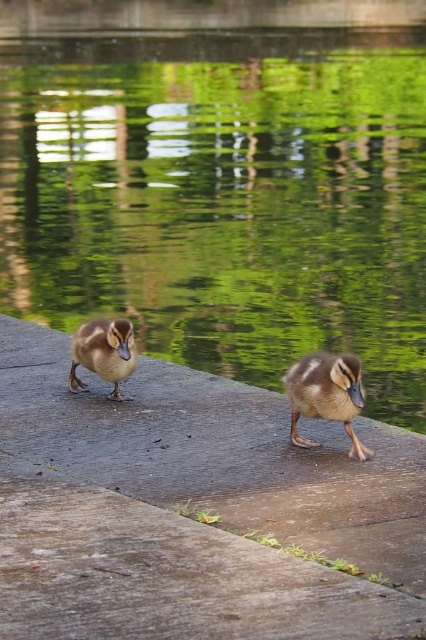
Is brown concrete ledge at center shorter than brown matte duckling at center?

No.

Describe the element at coordinates (192, 509) in the screenshot. I see `brown concrete ledge at center` at that location.

Locate an element on the screen. The image size is (426, 640). brown concrete ledge at center is located at coordinates (192, 509).

Where is `brown concrete ledge at center`? This screenshot has width=426, height=640. brown concrete ledge at center is located at coordinates (192, 509).

Does green reflective water at center have a greater height compared to brown matte duckling at center?

Yes.

Is point (264, 104) positioned behind point (290, 404)?

Yes.

Where is `green reflective water at center`? green reflective water at center is located at coordinates (224, 196).

Describe the element at coordinates (224, 196) in the screenshot. I see `green reflective water at center` at that location.

Is green reflective water at center closer to the viewer compared to brown fuzzy duckling at center?

Yes, green reflective water at center is in front of brown fuzzy duckling at center.

Who is more forward, (359,83) or (118,384)?

Point (118,384) is in front.

At what (x,y) coordinates should I click in order to perform the action: click on green reflective water at center. Please return your answer as a coordinate pair (x, y). This screenshot has width=426, height=640. Looking at the image, I should click on (224, 196).